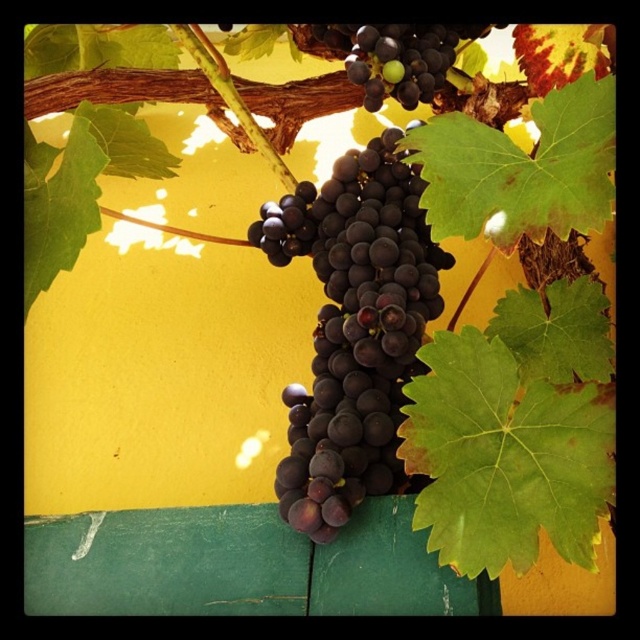
Question: Does shiny dark purple grapes at center have a larger size compared to shiny dark purple grapes at upper center?

Choices:
 (A) yes
 (B) no

Answer: (A)

Question: From the image, what is the correct spatial relationship of shiny dark purple grapes at center in relation to shiny dark purple grapes at upper center?

Choices:
 (A) left
 (B) right

Answer: (A)

Question: Is shiny dark purple grapes at center further to camera compared to shiny dark purple grapes at upper center?

Choices:
 (A) no
 (B) yes

Answer: (A)

Question: Which of the following is the farthest from the observer?

Choices:
 (A) shiny dark purple grapes at upper center
 (B) shiny dark purple grapes at center

Answer: (A)

Question: Which point is closer to the camera taking this photo?

Choices:
 (A) (401, 61)
 (B) (416, 189)

Answer: (B)